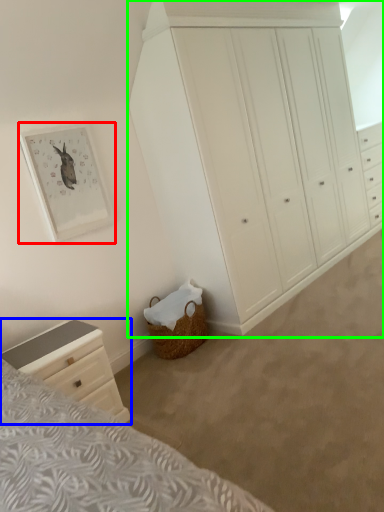
Question: Estimate the real-world distances between objects in this image. Which object is farther from picture frame (highlighted by a red box), chest of drawers (highlighted by a blue box) or chest of drawers (highlighted by a green box)?

Choices:
 (A) chest of drawers
 (B) chest of drawers

Answer: (B)